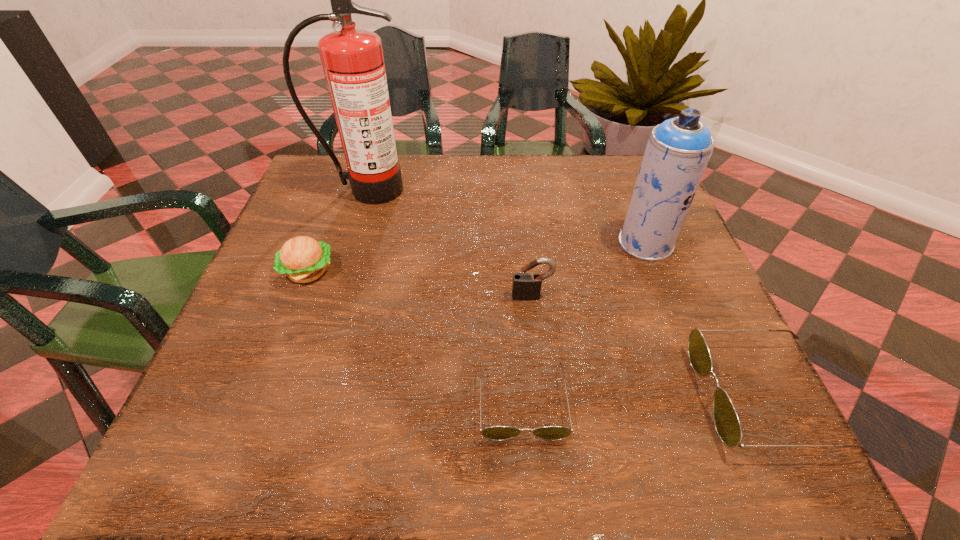
At what (x,y) coordinates should I click in order to perform the action: click on object that stands as the fourth closest to the padlock. Please return your answer as a coordinate pair (x, y). The image size is (960, 540). Looking at the image, I should click on (303, 259).

Identify the location of object that is the second closest one to the third nearest object. This screenshot has width=960, height=540. (678, 150).